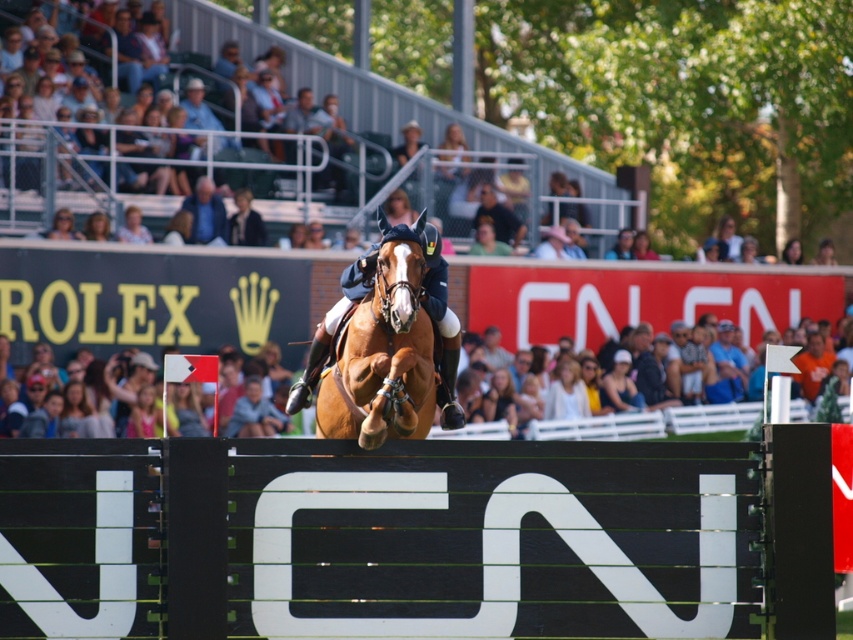
Question: Is black plastic hurdle at center smaller than white cotton shirt at center?

Choices:
 (A) yes
 (B) no

Answer: (B)

Question: Which of the following is the farthest from the observer?

Choices:
 (A) (454, 403)
 (B) (428, 472)

Answer: (A)

Question: Which point is farther to the camera?

Choices:
 (A) (666, 420)
 (B) (566, 371)
 (C) (583, 618)

Answer: (B)

Question: Estimate the real-world distances between objects in this image. Which object is closer to the white cotton shirt at center?

Choices:
 (A) light brown hair at center
 (B) black plastic hurdle at center
 (C) glossy brown horse at center

Answer: (A)

Question: Can you confirm if glossy brown horse at center is wider than light brown hair at center?

Choices:
 (A) yes
 (B) no

Answer: (A)

Question: Does black plastic hurdle at center have a larger size compared to light brown hair at center?

Choices:
 (A) yes
 (B) no

Answer: (A)